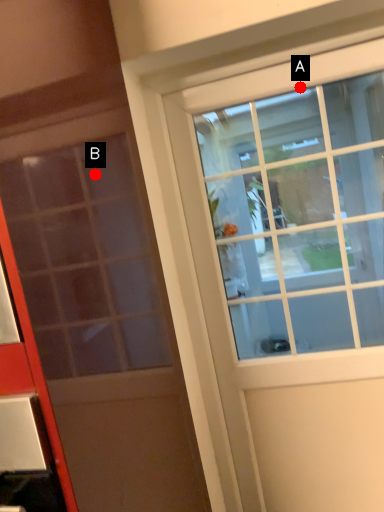
Question: Two points are circled on the image, labeled by A and B beside each circle. Which point is closer to the camera?

Choices:
 (A) A is closer
 (B) B is closer

Answer: (B)